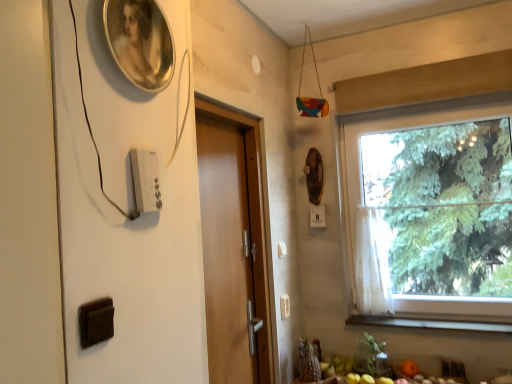
Question: Is wooden door at center at the back of wooden at lower right?

Choices:
 (A) no
 (B) yes

Answer: (A)

Question: From a real-world perspective, is wooden at lower right physically above wooden door at center?

Choices:
 (A) yes
 (B) no

Answer: (B)

Question: Is wooden at lower right not close to wooden door at center?

Choices:
 (A) yes
 (B) no

Answer: (B)

Question: Can you confirm if wooden at lower right is thinner than wooden door at center?

Choices:
 (A) yes
 (B) no

Answer: (B)

Question: Can you confirm if wooden at lower right is wider than wooden door at center?

Choices:
 (A) no
 (B) yes

Answer: (B)

Question: Considering the positions of wooden door at center and wooden at lower right in the image, is wooden door at center wider or thinner than wooden at lower right?

Choices:
 (A) thin
 (B) wide

Answer: (A)

Question: Is point (206, 158) closer or farther from the camera than point (468, 329)?

Choices:
 (A) closer
 (B) farther

Answer: (A)

Question: In terms of height, does wooden door at center look taller or shorter compared to wooden at lower right?

Choices:
 (A) tall
 (B) short

Answer: (A)

Question: Relative to wooden at lower right, is wooden door at center in front or behind?

Choices:
 (A) behind
 (B) front

Answer: (B)

Question: Is white plastic light switch at lower right, placed as the second light switch when sorted from front to back, spatially inside white plastic light switch at center, the 3th light switch viewed from the front, or outside of it?

Choices:
 (A) inside
 (B) outside

Answer: (B)

Question: Considering the positions of point click(288, 311) and point click(311, 210), is point click(288, 311) closer or farther from the camera than point click(311, 210)?

Choices:
 (A) farther
 (B) closer

Answer: (B)

Question: From a real-world perspective, is white plastic light switch at lower right, the 1th light switch ordered from the bottom, physically located above or below white plastic light switch at center, which appears as the second light switch when ordered from the bottom?

Choices:
 (A) below
 (B) above

Answer: (A)

Question: Considering the positions of white plastic light switch at lower right, marked as the second light switch in a back-to-front arrangement, and white plastic light switch at center, acting as the first light switch starting from the back, in the image, is white plastic light switch at lower right, marked as the second light switch in a back-to-front arrangement, wider or thinner than white plastic light switch at center, acting as the first light switch starting from the back,?

Choices:
 (A) wide
 (B) thin

Answer: (B)

Question: Choose the correct answer: Is white sheer curtain at window inside wooden door at center or outside it?

Choices:
 (A) outside
 (B) inside

Answer: (A)

Question: Does point (358, 240) appear closer or farther from the camera than point (206, 289)?

Choices:
 (A) farther
 (B) closer

Answer: (A)